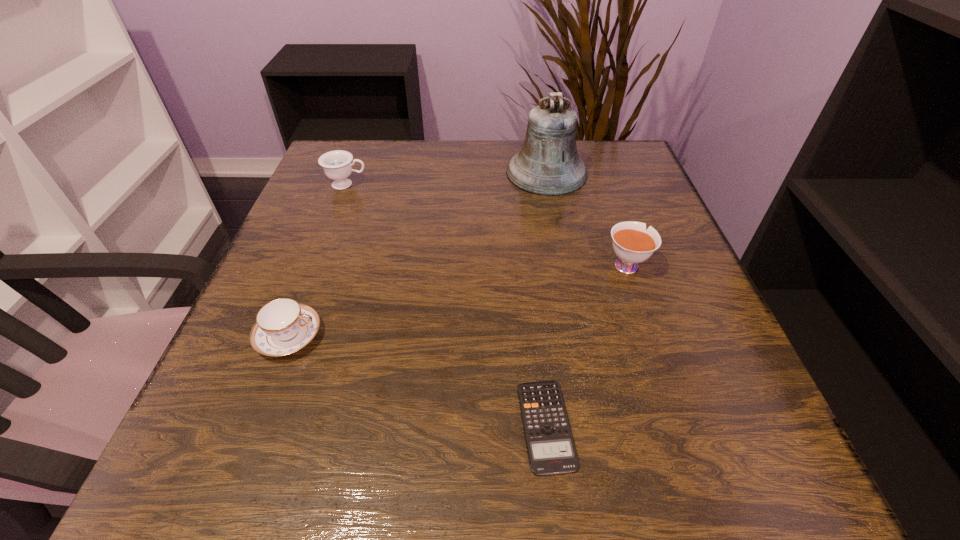
Locate an element on the screen. This screenshot has height=540, width=960. free space that satisfies the following two spatial constraints: 1. on the side of the second nearest teacup with the handle; 2. on the side of the farthest teacup with the handle is located at coordinates (599, 184).

Locate an element on the screen. free point that satisfies the following two spatial constraints: 1. on the side of the farthest teacup with the handle; 2. on the right side of the shortest object is located at coordinates (255, 426).

Identify the location of blank area in the image that satisfies the following two spatial constraints: 1. on the side of the farthest teacup with the handle; 2. on the side of the third nearest object with the handle. (317, 264).